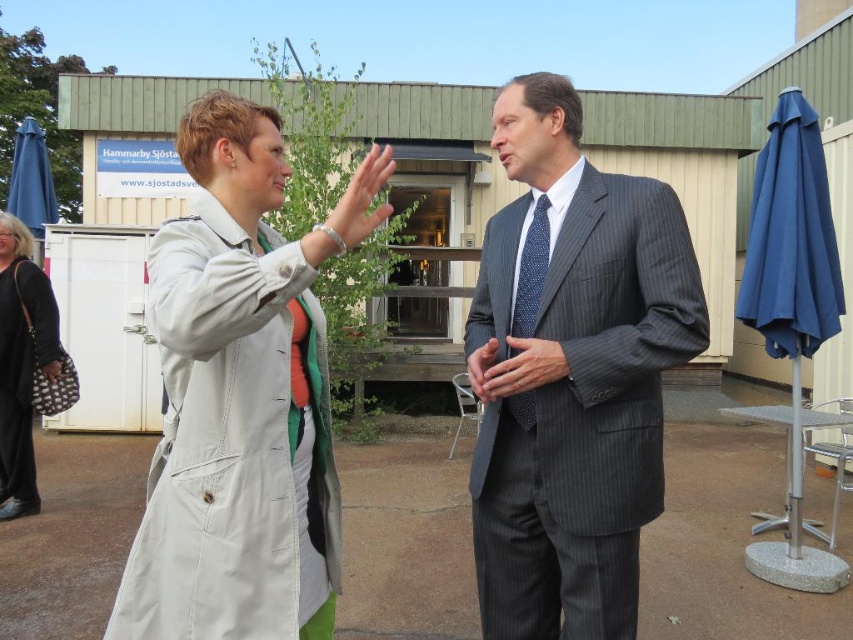
You are a tailor who needs to determine which item requires more fabric between the smooth gray suit at center and the matte black handbag at lower left. Which item would need more fabric?

The smooth gray suit at center is larger in size than the matte black handbag at lower left, so it would require more fabric.

You are taking a photo of the two people in the scene. The two points, point [809,323] and point [3,339], are part of their clothing. Which point is closer to the camera?

Point [809,323] is closer to the camera than point [3,339].

You are standing in the scene and need to retrieve your items. You have to pick up the blue fabric umbrella at right and the black fabric purse at lower left. Which item should you pick up first if you want to start from the closest one to you?

The black fabric purse at lower left is closer to you than the blue fabric umbrella at right, so you should pick up the black fabric purse at lower left first.